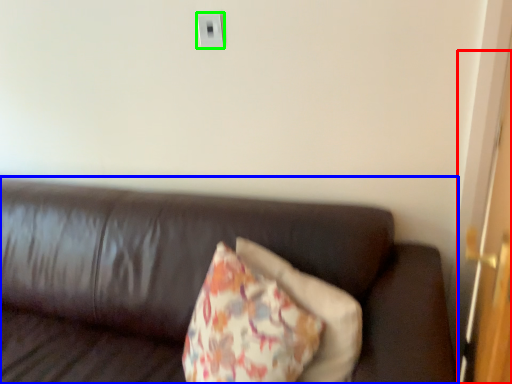
Question: Which object is the closest to the door (highlighted by a red box)? Choose among these: studio couch (highlighted by a blue box) or electric outlet (highlighted by a green box).

Choices:
 (A) studio couch
 (B) electric outlet

Answer: (A)